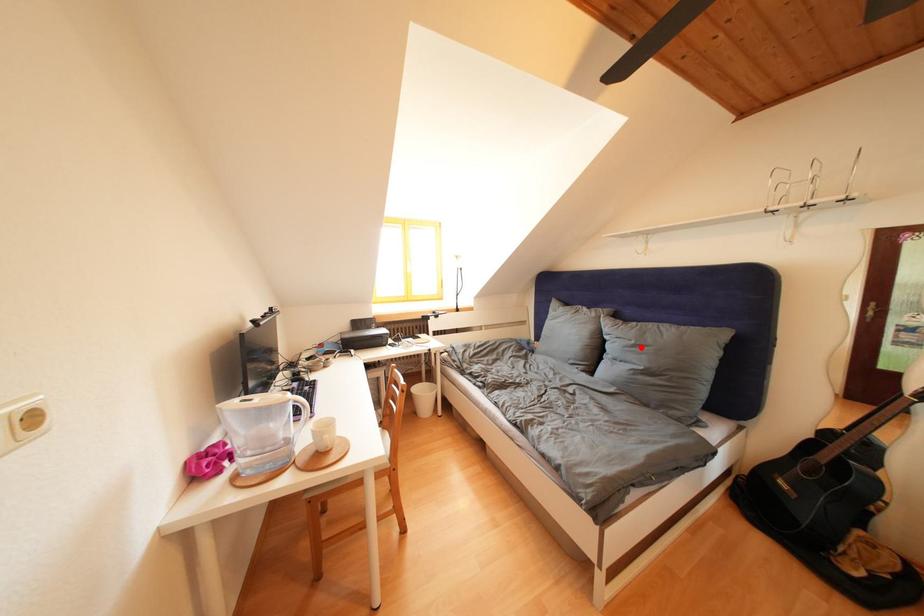
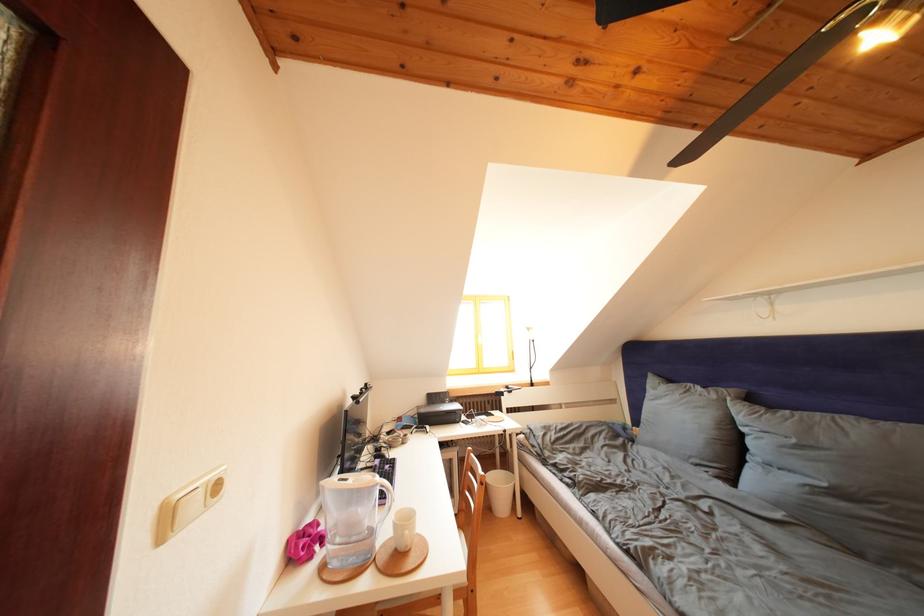
Question: I am providing you with two images of the same scene from different viewpoints. A red point is marked on the first image. At the location where the point appears in image 1, is it still visible in image 2?

Choices:
 (A) Yes
 (B) No

Answer: (A)